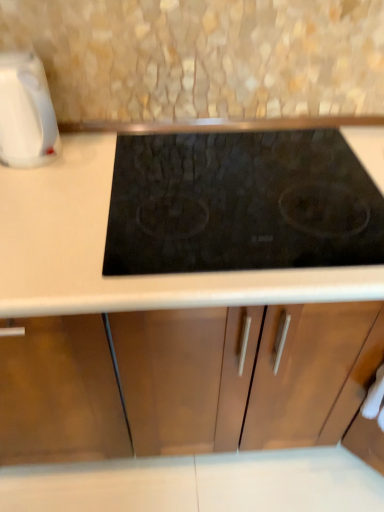
Identify the location of free space in front of white glossy kettle at left. Image resolution: width=384 pixels, height=512 pixels. (41, 199).